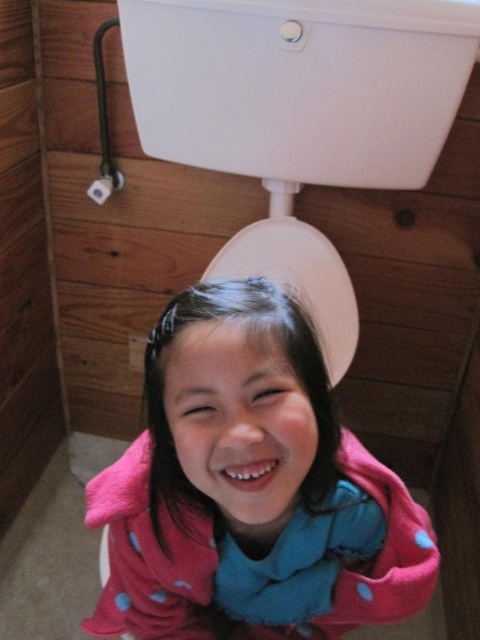
Question: Which is nearer to the white glossy toilet tank at upper center?

Choices:
 (A) pink polka dot towel at lower center
 (B) white glossy toilet lid at center

Answer: (B)

Question: Does white glossy toilet tank at upper center have a greater width compared to white glossy toilet lid at center?

Choices:
 (A) no
 (B) yes

Answer: (B)

Question: Which point is farther to the camera?

Choices:
 (A) (344, 374)
 (B) (252, 371)

Answer: (A)

Question: Does pink polka dot towel at lower center appear on the left side of white glossy toilet tank at upper center?

Choices:
 (A) yes
 (B) no

Answer: (A)

Question: Which point is closer to the camera?

Choices:
 (A) white glossy toilet lid at center
 (B) pink polka dot towel at lower center
 (C) white glossy toilet tank at upper center

Answer: (B)

Question: Can you confirm if pink polka dot towel at lower center is positioned above white glossy toilet lid at center?

Choices:
 (A) no
 (B) yes

Answer: (A)